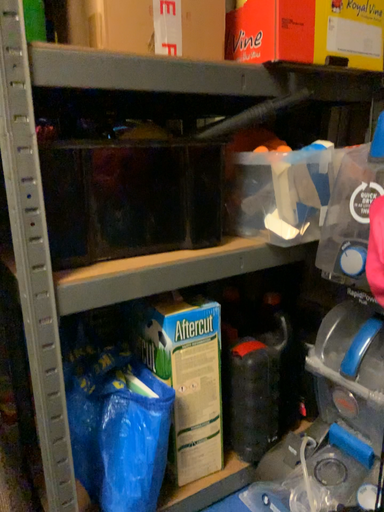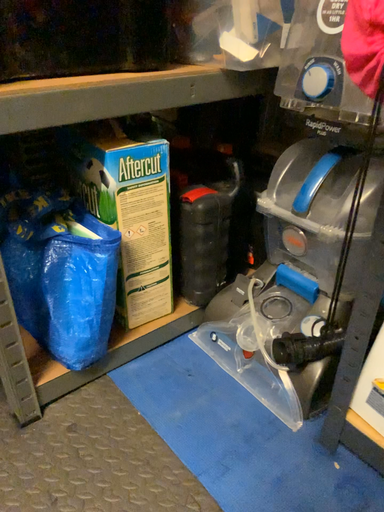
Question: Which way did the camera rotate in the video?

Choices:
 (A) rotated downward
 (B) rotated upward

Answer: (A)